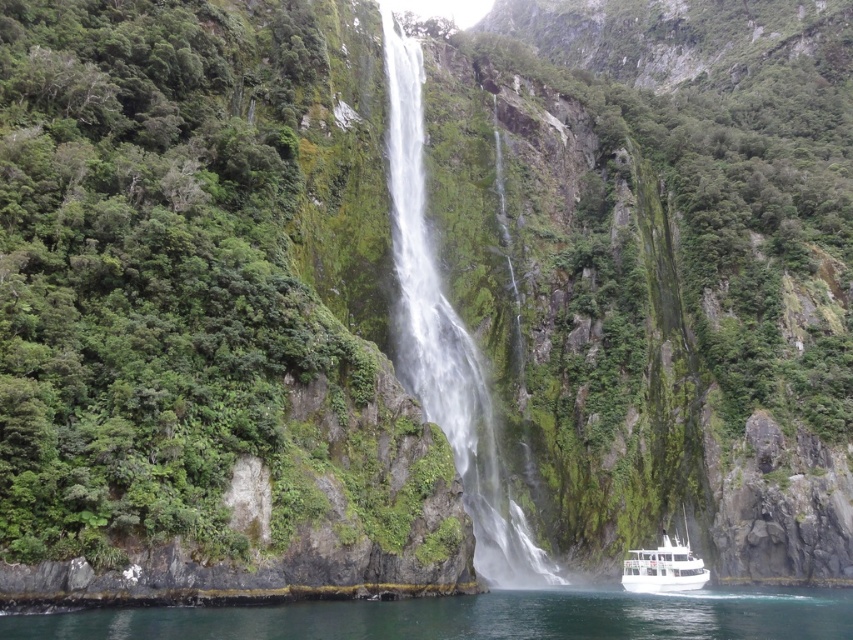
Question: Which object appears farthest from the camera in this image?

Choices:
 (A) clear water at lower left
 (B) white glossy boat at lower center

Answer: (B)

Question: Considering the relative positions of white frothy water at center and white glossy boat at lower center in the image provided, where is white frothy water at center located with respect to white glossy boat at lower center?

Choices:
 (A) right
 (B) left

Answer: (B)

Question: Is clear water at lower left further to camera compared to white glossy boat at lower center?

Choices:
 (A) no
 (B) yes

Answer: (A)

Question: Based on their relative distances, which object is nearer to the white glossy boat at lower center?

Choices:
 (A) clear water at lower left
 (B) white frothy water at center

Answer: (A)

Question: Which point is farther to the camera?

Choices:
 (A) white frothy water at center
 (B) white glossy boat at lower center
 (C) clear water at lower left

Answer: (A)

Question: In this image, where is clear water at lower left located relative to white glossy boat at lower center?

Choices:
 (A) above
 (B) below

Answer: (A)